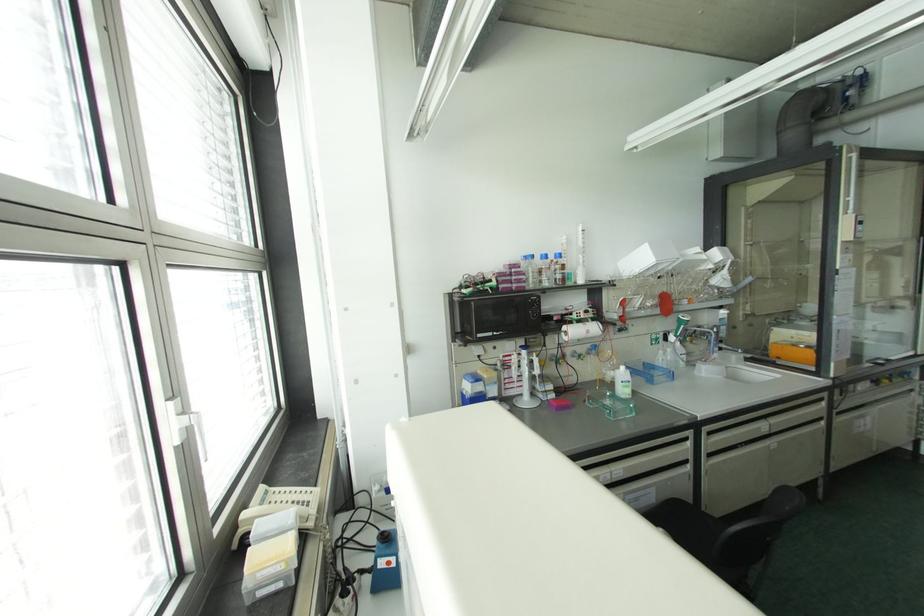
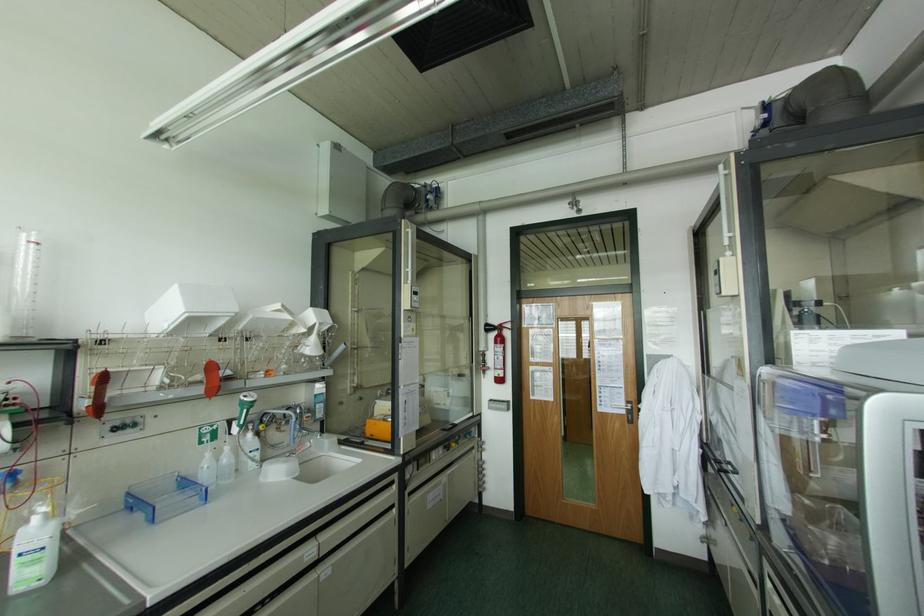
The point at (624, 302) is marked in the first image. Where is the corresponding point in the second image?

(102, 379)